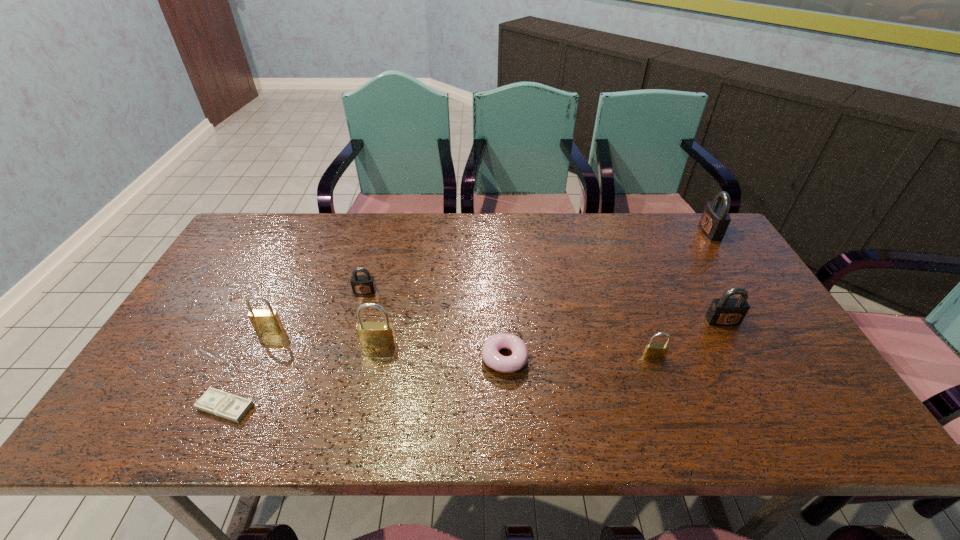
You are a GUI agent. You are given a task and a screenshot of the screen. Output one action in this format:
    pyautogui.click(x=<x>, y=<y>)
    Task: Click on the vacant space located on the front of the second object from right to left near the keyhole
    The width and height of the screenshot is (960, 540).
    Given the screenshot: What is the action you would take?
    pyautogui.click(x=775, y=416)

Locate an element on the screen. The width and height of the screenshot is (960, 540). vacant region located on the front-facing side of the leftmost padlock is located at coordinates (251, 369).

Locate an element on the screen. free region located on the front of the leftmost gray padlock near the keyhole is located at coordinates (349, 348).

The height and width of the screenshot is (540, 960). I want to click on vacant space situated on the front-facing side of the nearest padlock, so click(663, 384).

Locate an element on the screen. The height and width of the screenshot is (540, 960). vacant space located on the back of the purple doughnut is located at coordinates (500, 267).

Image resolution: width=960 pixels, height=540 pixels. Find the location of `vacant space located 0.090m on the left of the nearest object`. vacant space located 0.090m on the left of the nearest object is located at coordinates (157, 407).

Locate an element on the screen. The image size is (960, 540). object that is at the far edge is located at coordinates (715, 219).

I want to click on object that is at the near edge, so click(x=214, y=401).

Identify the location of object that is at the far right corner. (715, 219).

Identify the location of free space at the far edge. The width and height of the screenshot is (960, 540). (359, 219).